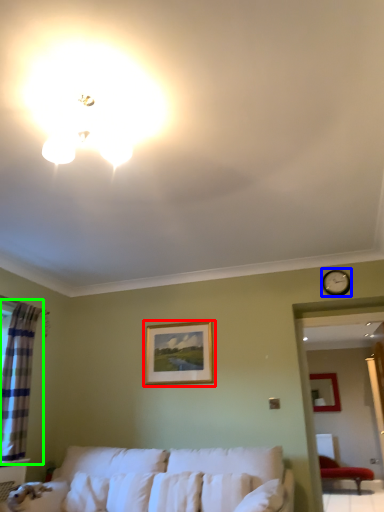
Question: Considering the real-world distances, which object is farthest from picture frame (highlighted by a red box)? clock (highlighted by a blue box) or curtain (highlighted by a green box)?

Choices:
 (A) clock
 (B) curtain

Answer: (A)